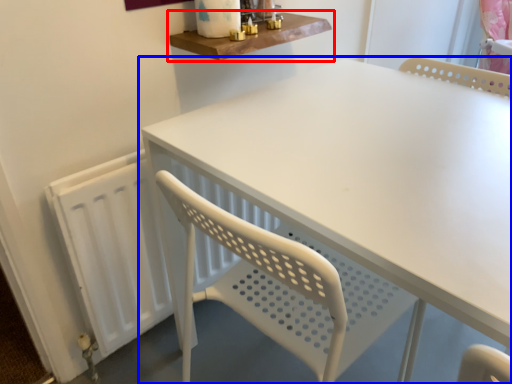
Question: Which point is further to the camera, shelf (highlighted by a red box) or table (highlighted by a blue box)?

Choices:
 (A) shelf
 (B) table

Answer: (A)